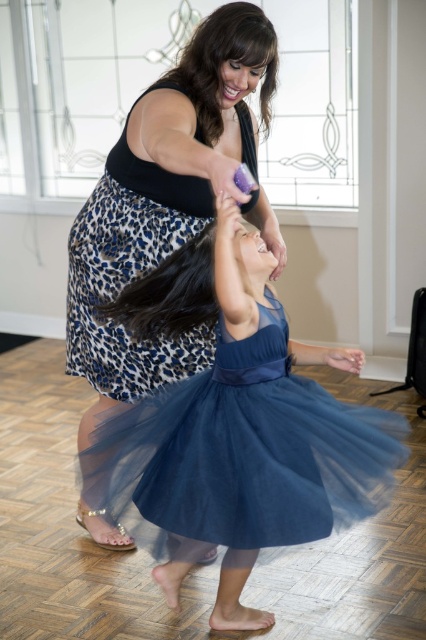
What is the location of the point with coordinates (235, 428) in the image?

The point with coordinates (235, 428) is located on the navy tulle dress at center.